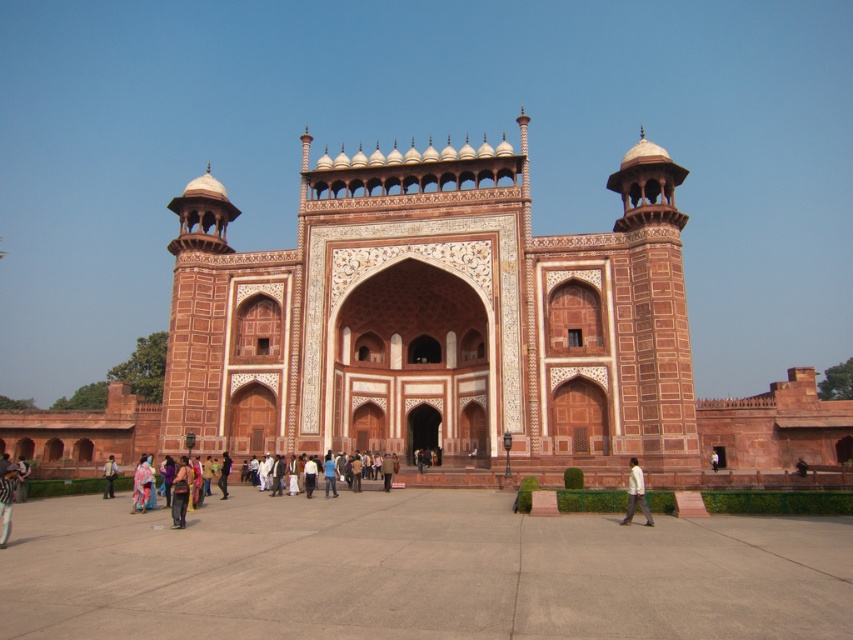
Based on the photo, you are standing at the base of the monument and want to reach the point marked at coordinates point [144,474]. Given that the monument is 43.16 meters tall, can you estimate how far you need to walk to reach that point?

The point marked at coordinates point [144,474] is 43.16 meters away from the viewer, so you would need to walk approximately 43.16 meters to reach it.

You are an interior designer planning to place a large sofa in the room. You notice the dark brown leather pants at lower left and the light brown fabric jacket at lower left. Which object takes up more space in the lower left area?

The light brown fabric jacket at lower left occupies more space than the dark brown leather pants at lower left, so it takes up more space in the lower left area.

You are standing in front of the monument and see the multicolored fabric at center and the light brown fabric jacket at lower left. Which object is positioned higher in the scene?

The multicolored fabric at center is positioned higher than the light brown fabric jacket at lower left.